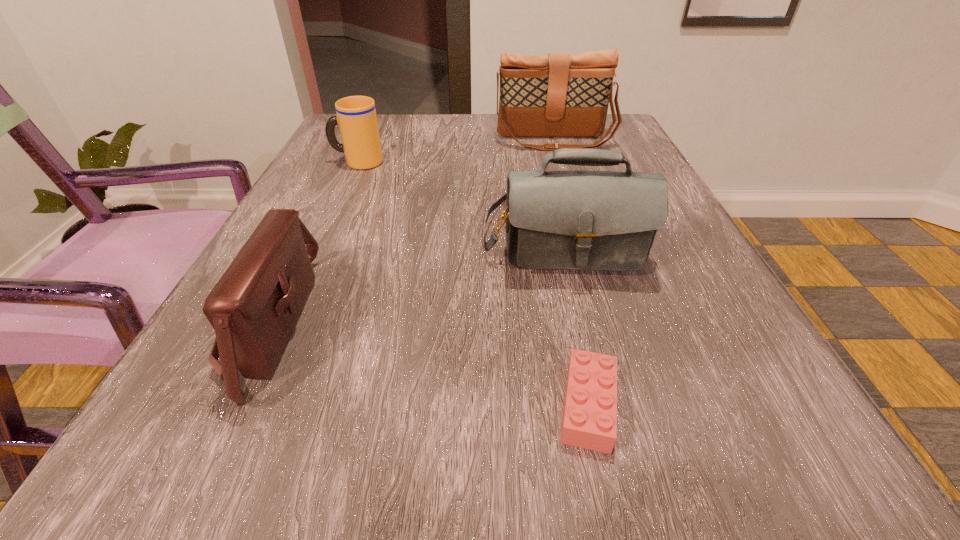
The image size is (960, 540). I want to click on free area in between the shortest shoulder bag and the farthest object, so click(412, 233).

Locate an element on the screen. This screenshot has width=960, height=540. free space between the Lego and the shortest shoulder bag is located at coordinates (429, 366).

At what (x,y) coordinates should I click in order to perform the action: click on vacant space that's between the cup and the Lego. Please return your answer as a coordinate pair (x, y). Looking at the image, I should click on (472, 284).

The image size is (960, 540). I want to click on vacant area between the farthest object and the shortest object, so click(x=571, y=273).

Where is `the third closest object to the farthest shoulder bag`? Image resolution: width=960 pixels, height=540 pixels. the third closest object to the farthest shoulder bag is located at coordinates (253, 308).

Select which object appears as the fourth closest to the fourth nearest object. Please provide its 2D coordinates. Your answer should be formatted as a tuple, i.e. [(x, y)], where the tuple contains the x and y coordinates of a point satisfying the conditions above.

[(589, 421)]

Choose which shoulder bag is the nearest neighbor to the farthest object. Please provide its 2D coordinates. Your answer should be formatted as a tuple, i.e. [(x, y)], where the tuple contains the x and y coordinates of a point satisfying the conditions above.

[(559, 220)]

Choose which shoulder bag is the nearest neighbor to the fourth nearest object. Please provide its 2D coordinates. Your answer should be formatted as a tuple, i.e. [(x, y)], where the tuple contains the x and y coordinates of a point satisfying the conditions above.

[(559, 220)]

At what (x,y) coordinates should I click in order to perform the action: click on vacant space that satisfies the following two spatial constraints: 1. on the front-facing side of the farthest object; 2. on the front flap of the leftmost shoulder bag. Please return your answer as a coordinate pair (x, y). Image resolution: width=960 pixels, height=540 pixels. Looking at the image, I should click on (610, 325).